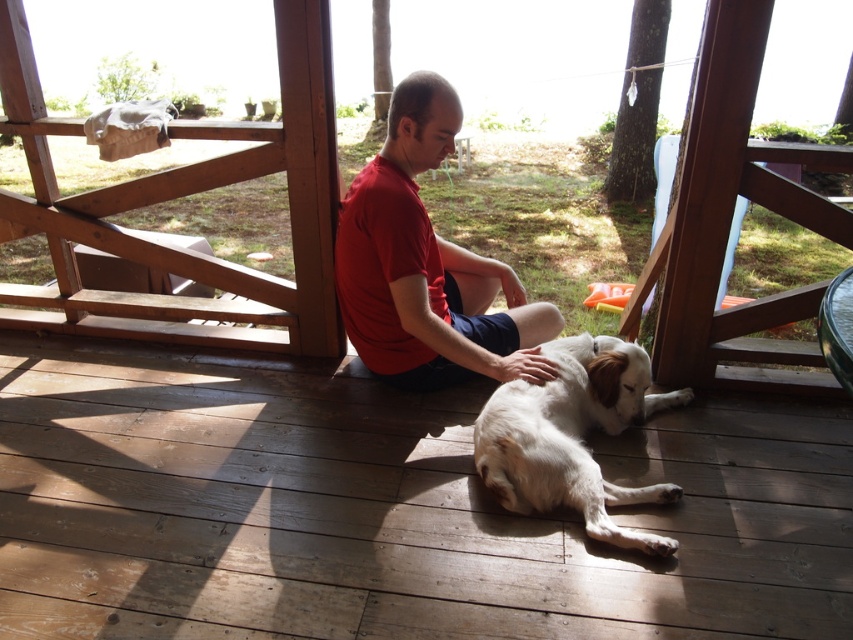
Is the position of matte red shirt at center less distant than that of white fur dog at center?

No.

Can you confirm if matte red shirt at center is taller than white fur dog at center?

Yes.

Image resolution: width=853 pixels, height=640 pixels. In order to click on matte red shirt at center in this screenshot , I will do `click(426, 266)`.

Who is positioned more to the right, wooden deck at center or white fur dog at center?

Positioned to the right is white fur dog at center.

Is point (787, 552) positioned after point (561, 452)?

No, (787, 552) is in front of (561, 452).

Which is behind, point (824, 579) or point (498, 483)?

Positioned behind is point (498, 483).

Locate an element on the screen. This screenshot has width=853, height=640. wooden deck at center is located at coordinates (386, 509).

Does wooden deck at center appear over matte red shirt at center?

No.

Is wooden deck at center positioned at the back of matte red shirt at center?

No, wooden deck at center is closer to the viewer.

What are the coordinates of `wooden deck at center` in the screenshot? It's located at (386, 509).